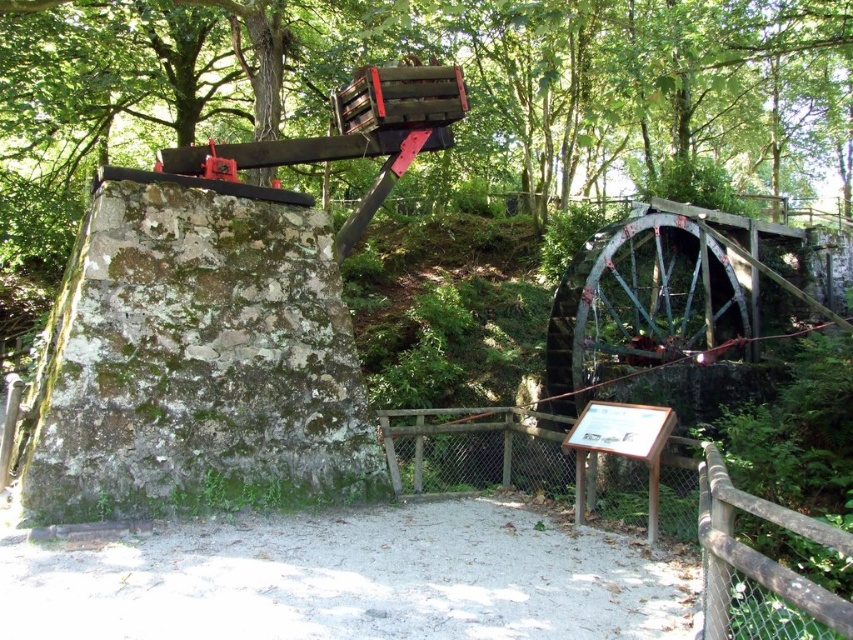
Question: Which object is farther from the camera taking this photo?

Choices:
 (A) green mossy stone at left
 (B) dirt ground at center
 (C) brown wooden sign at center

Answer: (C)

Question: Which object appears farthest from the camera in this image?

Choices:
 (A) green mossy stone at left
 (B) dirt ground at center
 (C) brown wooden sign at center

Answer: (C)

Question: Is dirt ground at center bigger than brown wooden sign at center?

Choices:
 (A) yes
 (B) no

Answer: (A)

Question: Is green mossy stone at left smaller than dirt ground at center?

Choices:
 (A) yes
 (B) no

Answer: (B)

Question: Among these points, which one is farthest from the camera?

Choices:
 (A) (682, 456)
 (B) (666, 628)

Answer: (A)

Question: Can you confirm if green mossy stone at left is positioned to the right of dirt ground at center?

Choices:
 (A) no
 (B) yes

Answer: (A)